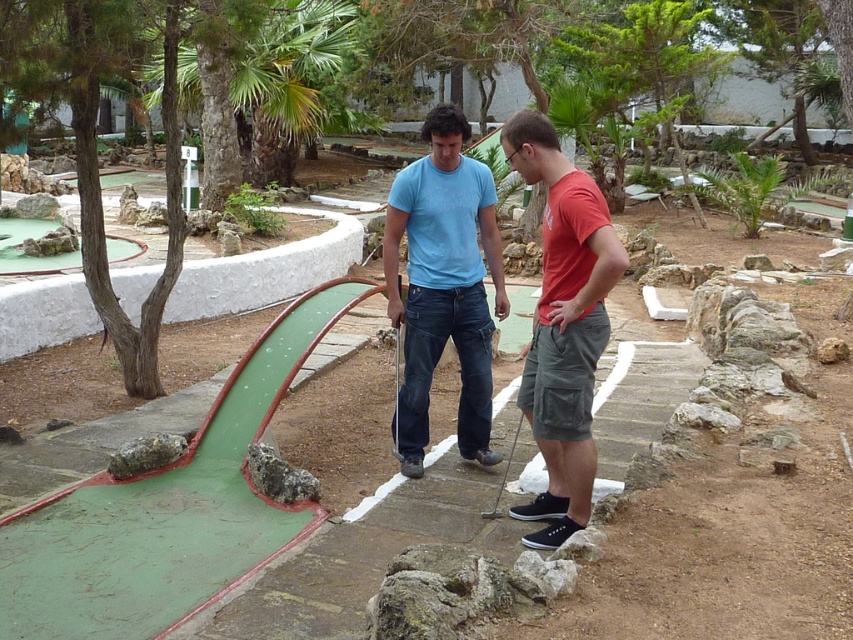
Between matte blue jeans at center and matte red t-shirt at center, which one has less height?

Standing shorter between the two is matte red t-shirt at center.

Can you confirm if matte blue jeans at center is wider than matte red t-shirt at center?

Indeed, matte blue jeans at center has a greater width compared to matte red t-shirt at center.

Does point (459, 445) come behind point (595, 364)?

Yes.

Identify the location of matte blue jeans at center. This screenshot has width=853, height=640. (444, 285).